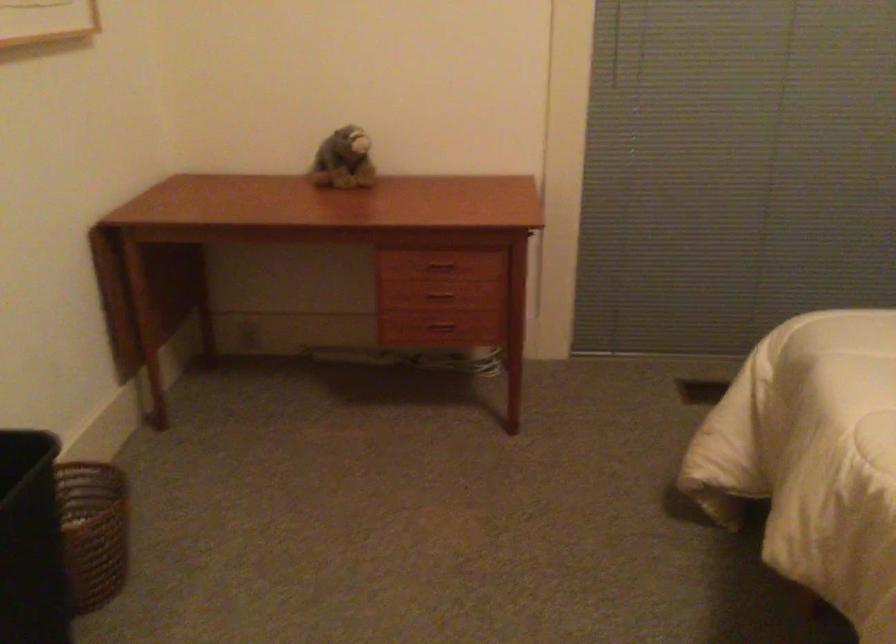
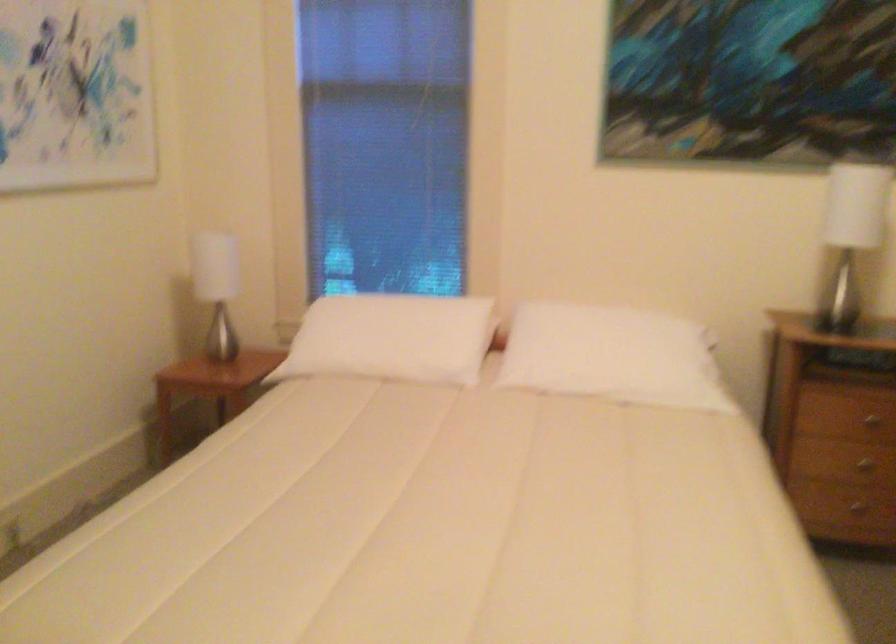
Question: The images are taken continuously from a first-person perspective. In which direction is your viewpoint rotating?

Choices:
 (A) Left
 (B) Right
 (C) Up
 (D) Down

Answer: (B)